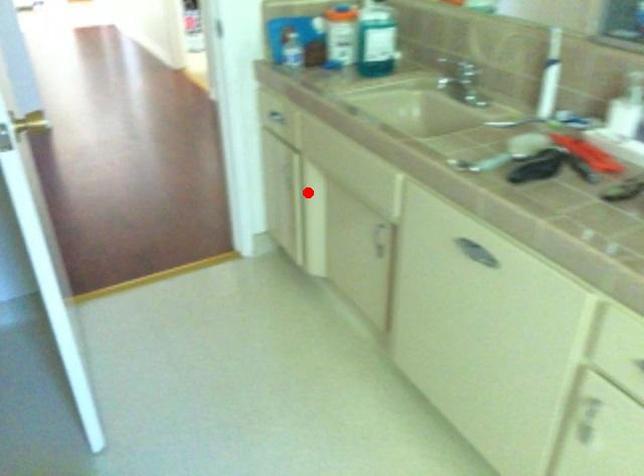
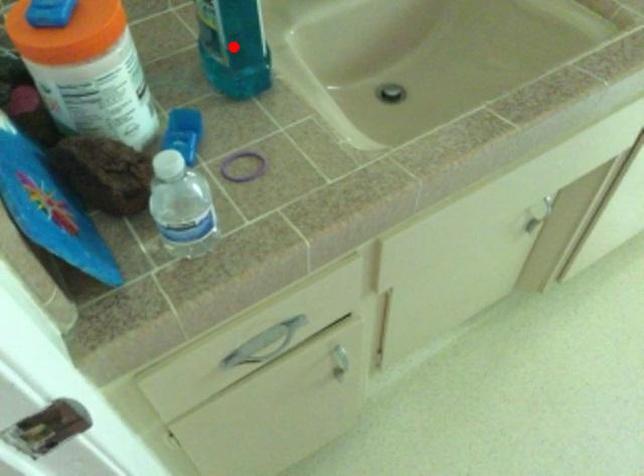
I am providing you with two images of the same scene from different viewpoints. A red point is marked on the first image and another point is marked on the second image. Is the red point in image1 aligned with the point shown in image2?

No